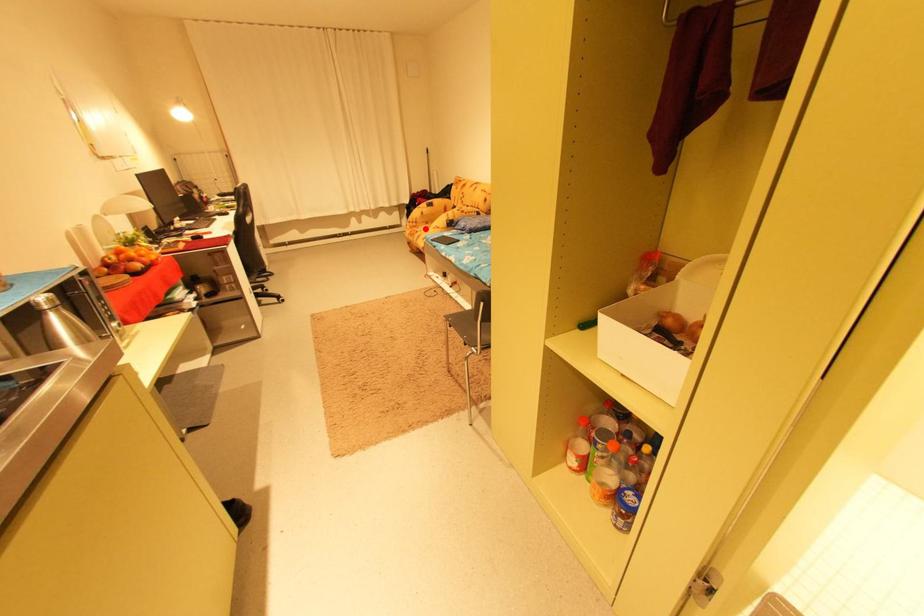
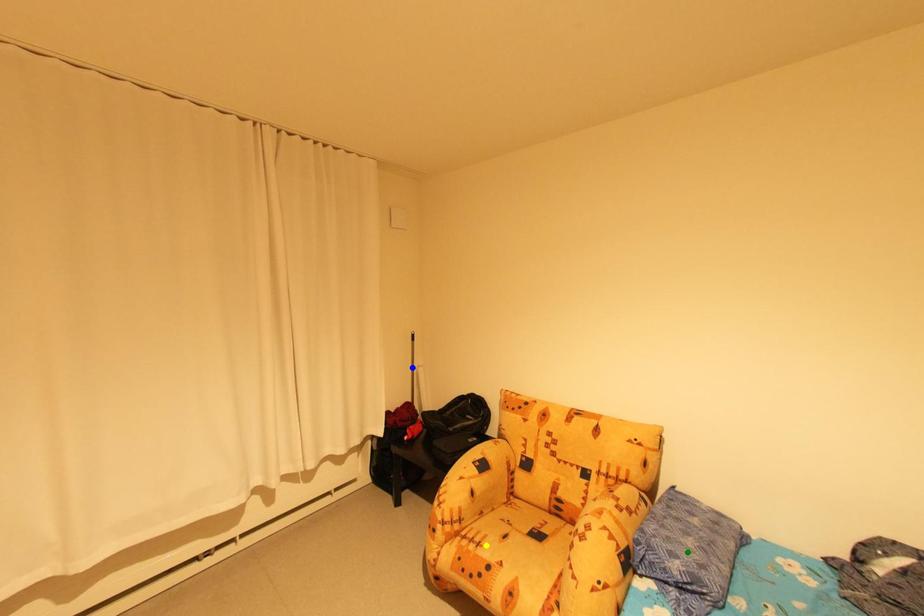
Question: I am providing you with two images of the same scene from different viewpoints. A red point is marked on the first image. You are given multiple points on the second image. In image 2, which mark is for the same physical point as the one in image 1?

Choices:
 (A) blue point
 (B) green point
 (C) yellow point

Answer: (C)